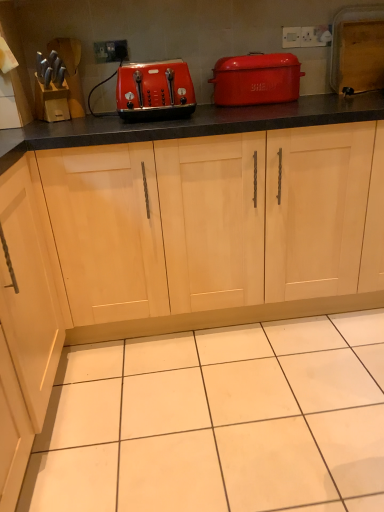
What do you see at coordinates (256, 79) in the screenshot? I see `matte red bread bin at upper center` at bounding box center [256, 79].

The width and height of the screenshot is (384, 512). Find the location of `matte plastic toaster at center`. matte plastic toaster at center is located at coordinates (154, 91).

This screenshot has height=512, width=384. Identify the location of light wood cabinet at center. [215, 221].

At what (x,y) coordinates should I click in order to perform the action: click on matte red bread bin at upper center. Please return your answer as a coordinate pair (x, y). Looking at the image, I should click on (256, 79).

Is matte red bread bin at upper center wider or thinner than white plastic electric outlet at upper center?

matte red bread bin at upper center is wider than white plastic electric outlet at upper center.

Can you confirm if matte red bread bin at upper center is positioned to the left of white plastic electric outlet at upper center?

Incorrect, matte red bread bin at upper center is not on the left side of white plastic electric outlet at upper center.

Considering the relative positions of matte red bread bin at upper center and white plastic electric outlet at upper center in the image provided, is matte red bread bin at upper center behind white plastic electric outlet at upper center?

No, matte red bread bin at upper center is in front of white plastic electric outlet at upper center.

In terms of height, does matte red bread bin at upper center look taller or shorter compared to white plastic electric outlet at upper center?

Considering their sizes, matte red bread bin at upper center has more height than white plastic electric outlet at upper center.

Who is smaller, white plastic electric outlet at upper center or matte red bread bin at upper center?

Smaller between the two is white plastic electric outlet at upper center.

In terms of height, does white plastic electric outlet at upper center look taller or shorter compared to matte red bread bin at upper center?

In the image, white plastic electric outlet at upper center appears to be shorter than matte red bread bin at upper center.

Is the position of white plastic electric outlet at upper center more distant than that of matte red bread bin at upper center?

That is True.

From a real-world perspective, which object rests below the other?

matte red bread bin at upper center, from a real-world perspective.

Visually, is light wood cabinet at center positioned to the left or to the right of matte red bread bin at upper center?

Based on their positions, light wood cabinet at center is located to the left of matte red bread bin at upper center.

Looking at this image, from the image's perspective, is light wood cabinet at center beneath matte red bread bin at upper center?

Yes.

In the image, there is a matte red bread bin at upper center. Identify the location of cabinetry below it (from the image's perspective). (215, 221).

Considering the points (129, 176) and (266, 63), which point is in front, point (129, 176) or point (266, 63)?

The point (129, 176) is closer to the camera.

Is white plastic electric outlet at upper center at the back of light wood cabinet at center?

That's not correct — light wood cabinet at center is not looking away from white plastic electric outlet at upper center.

From a real-world perspective, is light wood cabinet at center physically located above or below white plastic electric outlet at upper center?

light wood cabinet at center is below white plastic electric outlet at upper center.

Does light wood cabinet at center have a greater width compared to white plastic electric outlet at upper center?

Yes.

Looking at the image, does white plastic electric outlet at upper center seem bigger or smaller compared to matte plastic toaster at center?

Clearly, white plastic electric outlet at upper center is smaller in size than matte plastic toaster at center.

From the picture: Which is farther, (x=116, y=58) or (x=146, y=111)?

The point (x=116, y=58) is behind.

This screenshot has height=512, width=384. Find the location of `kitchen appliance in front of the white plastic electric outlet at upper center`. kitchen appliance in front of the white plastic electric outlet at upper center is located at coordinates point(154,91).

Which is more to the right, white plastic electric outlet at upper center or matte plastic toaster at center?

matte plastic toaster at center.

Is matte plastic toaster at center facing away from matte red bread bin at upper center?

No, matte plastic toaster at center is not facing the opposite direction of matte red bread bin at upper center.

Considering the positions of objects matte plastic toaster at center and matte red bread bin at upper center in the image provided, who is more to the left, matte plastic toaster at center or matte red bread bin at upper center?

Positioned to the left is matte plastic toaster at center.

Is matte plastic toaster at center completely or partially outside of matte red bread bin at upper center?

matte plastic toaster at center lies outside matte red bread bin at upper center's area.

Measure the distance between matte plastic toaster at center and matte red bread bin at upper center.

matte plastic toaster at center and matte red bread bin at upper center are 13.53 inches apart from each other.

Could you tell me if light wood cabinet at center is facing matte plastic toaster at center?

No, light wood cabinet at center is not facing towards matte plastic toaster at center.

Considering the relative sizes of light wood cabinet at center and matte plastic toaster at center in the image provided, is light wood cabinet at center shorter than matte plastic toaster at center?

Incorrect, the height of light wood cabinet at center does not fall short of that of matte plastic toaster at center.

At what (x,y) coordinates should I click in order to perform the action: click on electric outlet that is above the matte red bread bin at upper center (from a real-world perspective). Please return your answer as a coordinate pair (x, y). Looking at the image, I should click on (110, 51).

Identify the location of home appliance that is in front of the white plastic electric outlet at upper center. (256, 79).

From the image, which object appears to be nearer to matte plastic toaster at center, light wood cabinet at center or matte red bread bin at upper center?

matte red bread bin at upper center.

Which object lies nearer to the anchor point matte red bread bin at upper center, white plastic electric outlet at upper center or matte plastic toaster at center?

matte plastic toaster at center.

When comparing their distances from matte plastic toaster at center, does white plastic electric outlet at upper center or matte red bread bin at upper center seem closer?

Based on the image, matte red bread bin at upper center appears to be nearer to matte plastic toaster at center.

Considering their positions, is matte red bread bin at upper center positioned closer to light wood cabinet at center than white plastic electric outlet at upper center?

matte red bread bin at upper center is closer to light wood cabinet at center.

Looking at the image, which one is located further to light wood cabinet at center, matte plastic toaster at center or matte red bread bin at upper center?

Among the two, matte red bread bin at upper center is located further to light wood cabinet at center.

Based on their spatial positions, is matte red bread bin at upper center or light wood cabinet at center further from white plastic electric outlet at upper center?

light wood cabinet at center.

Considering their positions, is light wood cabinet at center positioned further to white plastic electric outlet at upper center than matte plastic toaster at center?

light wood cabinet at center is positioned further to the anchor white plastic electric outlet at upper center.

Considering their positions, is matte plastic toaster at center positioned further to matte red bread bin at upper center than light wood cabinet at center?

Based on the image, light wood cabinet at center appears to be further to matte red bread bin at upper center.

Where is `kitchen appliance located between white plastic electric outlet at upper center and matte red bread bin at upper center in the left-right direction`? The height and width of the screenshot is (512, 384). kitchen appliance located between white plastic electric outlet at upper center and matte red bread bin at upper center in the left-right direction is located at coordinates (154, 91).

Where is `kitchen appliance between matte red bread bin at upper center and light wood cabinet at center in the vertical direction`? kitchen appliance between matte red bread bin at upper center and light wood cabinet at center in the vertical direction is located at coordinates 154,91.

Where is `home appliance between white plastic electric outlet at upper center and light wood cabinet at center from top to bottom`? The width and height of the screenshot is (384, 512). home appliance between white plastic electric outlet at upper center and light wood cabinet at center from top to bottom is located at coordinates (256, 79).

Locate an element on the screen. The image size is (384, 512). kitchen appliance between white plastic electric outlet at upper center and light wood cabinet at center from top to bottom is located at coordinates (154, 91).